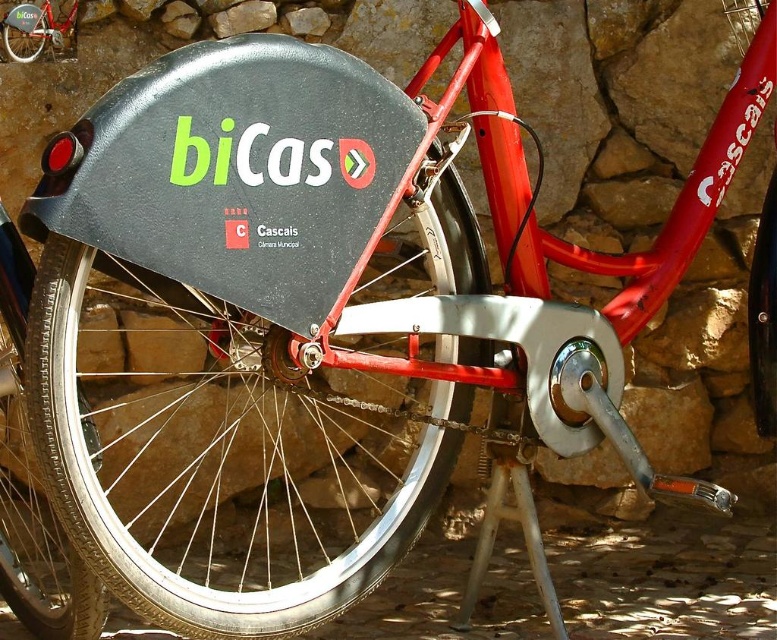
Question: Among these objects, which one is nearest to the camera?

Choices:
 (A) matte red bicycle at center
 (B) black rubber tire at lower left
 (C) black rubber tire at center

Answer: (C)

Question: Can you confirm if black rubber tire at center is positioned above matte red bicycle at center?

Choices:
 (A) no
 (B) yes

Answer: (A)

Question: Which object is closer to the camera taking this photo?

Choices:
 (A) black rubber tire at center
 (B) matte red bicycle at center
 (C) black rubber tire at lower left
 (D) black rubber tire at lower right

Answer: (A)

Question: Considering the relative positions of black rubber tire at center and matte red bicycle at center in the image provided, where is black rubber tire at center located with respect to matte red bicycle at center?

Choices:
 (A) above
 (B) below

Answer: (B)

Question: Among these points, which one is farthest from the camera?

Choices:
 (A) (14, 44)
 (B) (754, 413)

Answer: (B)

Question: Does black rubber tire at center have a greater width compared to black rubber tire at lower left?

Choices:
 (A) no
 (B) yes

Answer: (B)